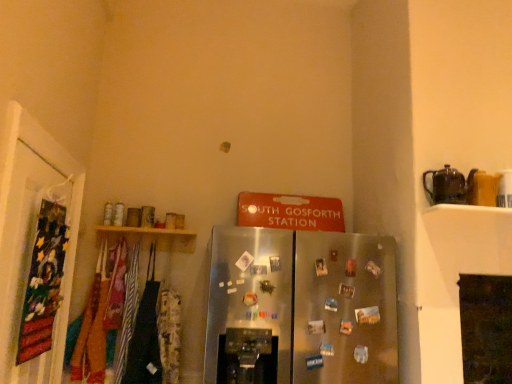
Question: Is wooden shelf at upper left outside velvet fabric banner at left?

Choices:
 (A) no
 (B) yes

Answer: (B)

Question: Does wooden shelf at upper left have a lesser height compared to velvet fabric banner at left?

Choices:
 (A) yes
 (B) no

Answer: (A)

Question: Would you consider wooden shelf at upper left to be distant from velvet fabric banner at left?

Choices:
 (A) yes
 (B) no

Answer: (B)

Question: Can you confirm if wooden shelf at upper left is taller than velvet fabric banner at left?

Choices:
 (A) no
 (B) yes

Answer: (A)

Question: From the image's perspective, is wooden shelf at upper left located beneath velvet fabric banner at left?

Choices:
 (A) yes
 (B) no

Answer: (B)

Question: Could you tell me if wooden shelf at upper left is turned towards velvet fabric banner at left?

Choices:
 (A) yes
 (B) no

Answer: (B)

Question: Considering the relative sizes of wooden shelf at upper left and brown ceramic teapot at upper right in the image provided, is wooden shelf at upper left wider than brown ceramic teapot at upper right?

Choices:
 (A) no
 (B) yes

Answer: (B)

Question: Is wooden shelf at upper left positioned behind brown ceramic teapot at upper right?

Choices:
 (A) yes
 (B) no

Answer: (A)

Question: Is wooden shelf at upper left positioned beyond the bounds of brown ceramic teapot at upper right?

Choices:
 (A) yes
 (B) no

Answer: (A)

Question: Is the surface of wooden shelf at upper left in direct contact with brown ceramic teapot at upper right?

Choices:
 (A) yes
 (B) no

Answer: (B)

Question: Is wooden shelf at upper left oriented towards brown ceramic teapot at upper right?

Choices:
 (A) no
 (B) yes

Answer: (A)

Question: Can you confirm if wooden shelf at upper left is thinner than brown ceramic teapot at upper right?

Choices:
 (A) yes
 (B) no

Answer: (B)

Question: Is satin silver refrigerator at center positioned behind velvet fabric banner at left?

Choices:
 (A) no
 (B) yes

Answer: (B)